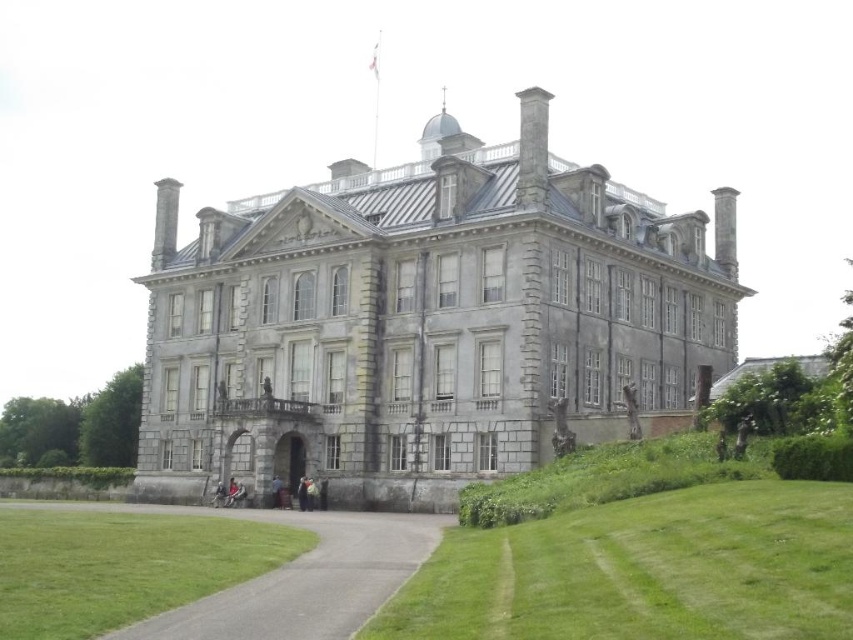
You are standing in front of the grand historic building and want to take a photo. You notice two points marked on the facade at coordinates point (366, 244) and point (279, 499). Which point appears closer to the camera in your photo?

Point (279, 499) appears closer to the camera in the photo because it is closer to the viewer than point (366, 244).

You are standing at the entrance of the gray stone mansion at center and want to drive your car to the gray asphalt driveway at lower center. Which direction should you turn to reach the driveway?

The gray stone mansion at center is to the right of the gray asphalt driveway at lower center, so you should turn left to reach the driveway.